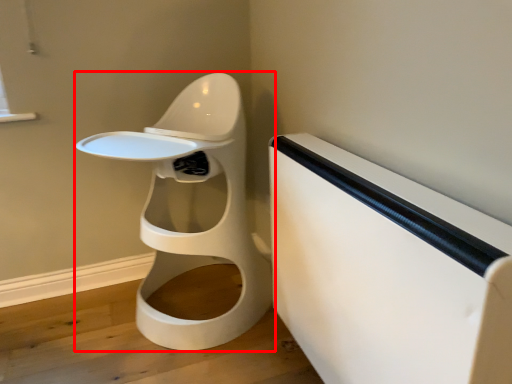
Question: Where is toilet (annotated by the red box) located in relation to changing table in the image?

Choices:
 (A) left
 (B) right

Answer: (A)